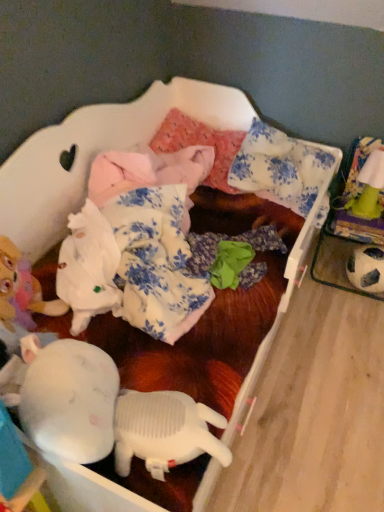
Question: Should I look upward or downward to see black and white textured soccer ball at right, which ranks as the 1th toy in bottom-to-top order?

Choices:
 (A) down
 (B) up

Answer: (A)

Question: Is green fabric toy at upper right, arranged as the 1th toy when viewed from the top, to the left of white floral fabric pillow at upper center, arranged as the second pillow when viewed from the left, from the viewer's perspective?

Choices:
 (A) no
 (B) yes

Answer: (A)

Question: Is green fabric toy at upper right, arranged as the 1th toy when viewed from the top, aimed at white floral fabric pillow at upper center, acting as the first pillow starting from the right?

Choices:
 (A) no
 (B) yes

Answer: (A)

Question: Can you confirm if green fabric toy at upper right, which is the second toy from bottom to top, is taller than white floral fabric pillow at upper center, arranged as the second pillow when viewed from the left?

Choices:
 (A) no
 (B) yes

Answer: (B)

Question: Is white floral fabric pillow at upper center, arranged as the second pillow when viewed from the left, located within green fabric toy at upper right, which is the second toy from bottom to top?

Choices:
 (A) no
 (B) yes

Answer: (A)

Question: Can you confirm if green fabric toy at upper right, which is the second toy from bottom to top, is smaller than white floral fabric pillow at upper center, arranged as the second pillow when viewed from the left?

Choices:
 (A) yes
 (B) no

Answer: (A)

Question: From a real-world perspective, does green fabric toy at upper right, arranged as the 1th toy when viewed from the top, sit lower than white floral fabric pillow at upper center, acting as the first pillow starting from the right?

Choices:
 (A) yes
 (B) no

Answer: (A)

Question: Does white floral fabric pillow at upper center, arranged as the second pillow when viewed from the left, appear on the left side of pink fabric pillow at center, placed as the second pillow when sorted from right to left?

Choices:
 (A) no
 (B) yes

Answer: (A)

Question: Considering the relative sizes of white floral fabric pillow at upper center, acting as the first pillow starting from the right, and pink fabric pillow at center, the 1th pillow viewed from the left, in the image provided, is white floral fabric pillow at upper center, acting as the first pillow starting from the right, shorter than pink fabric pillow at center, the 1th pillow viewed from the left,?

Choices:
 (A) yes
 (B) no

Answer: (B)

Question: Does white floral fabric pillow at upper center, acting as the first pillow starting from the right, have a greater height compared to pink fabric pillow at center, placed as the second pillow when sorted from right to left?

Choices:
 (A) yes
 (B) no

Answer: (A)

Question: Is white floral fabric pillow at upper center, acting as the first pillow starting from the right, not close to pink fabric pillow at center, placed as the second pillow when sorted from right to left?

Choices:
 (A) yes
 (B) no

Answer: (B)

Question: Is white floral fabric pillow at upper center, acting as the first pillow starting from the right, positioned in front of pink fabric pillow at center, placed as the second pillow when sorted from right to left?

Choices:
 (A) no
 (B) yes

Answer: (B)

Question: Is white floral fabric pillow at upper center, arranged as the second pillow when viewed from the left, smaller than pink fabric pillow at center, placed as the second pillow when sorted from right to left?

Choices:
 (A) yes
 (B) no

Answer: (B)

Question: From a real-world perspective, is green fabric toy at upper right, arranged as the 1th toy when viewed from the top, on top of black and white textured soccer ball at right, which ranks as the 1th toy in bottom-to-top order?

Choices:
 (A) no
 (B) yes

Answer: (B)